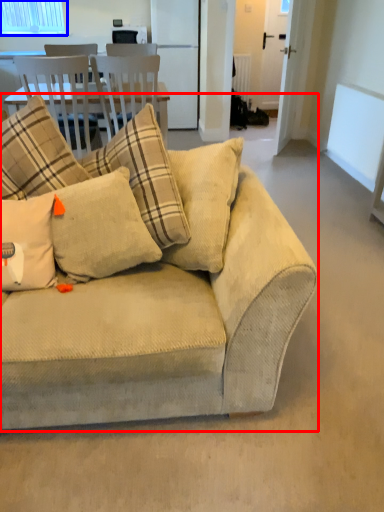
Question: Among these objects, which one is farthest to the camera, studio couch (highlighted by a red box) or window (highlighted by a blue box)?

Choices:
 (A) studio couch
 (B) window

Answer: (B)